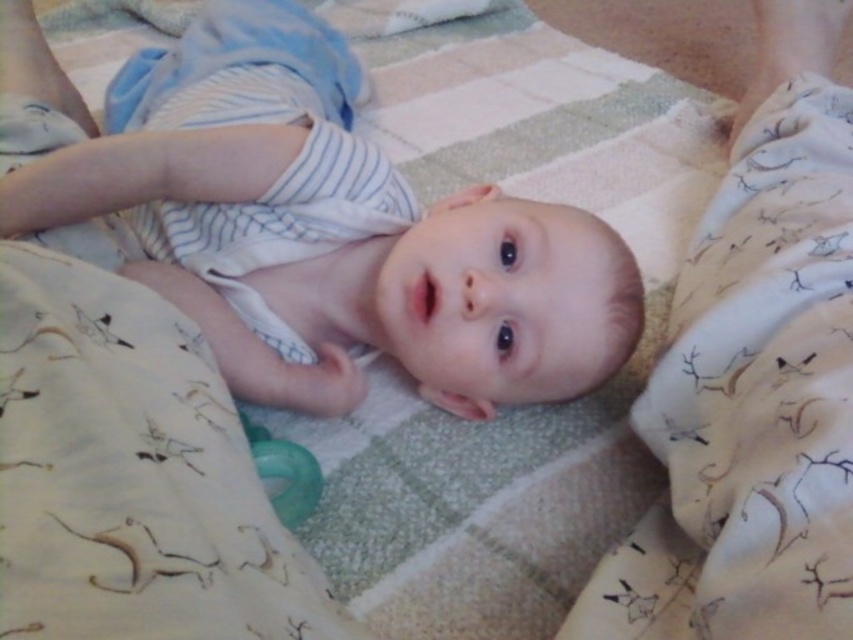
You are a photographer setting up for a baby photoshoot. You have a white soft baby at center and a green rubber pacifier at center in the scene. Based on the setup, which object would appear larger in the photo?

The white soft baby at center would appear larger in the photo since it has a greater height compared to the green rubber pacifier at center.